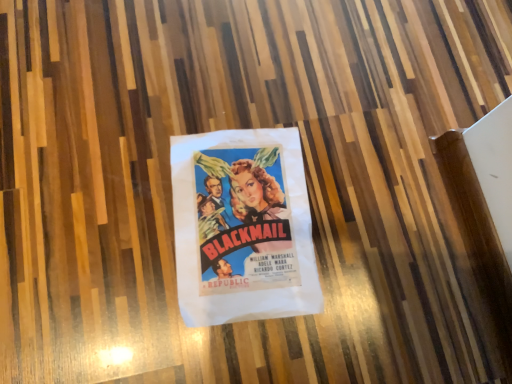
In order to face white paper poster at center, should I rotate leftwards or rightwards?

Rotate left and turn 1.441 degrees.

This screenshot has height=384, width=512. In order to click on white paper poster at center in this screenshot , I will do `click(242, 227)`.

Describe the element at coordinates (242, 227) in the screenshot. This screenshot has width=512, height=384. I see `white paper poster at center` at that location.

What is the approximate height of white paper poster at center?

The height of white paper poster at center is 1.16 inches.

You are a GUI agent. You are given a task and a screenshot of the screen. Output one action in this format:
    pyautogui.click(x=<x>, y=<y>)
    Task: Click on the white paper poster at center
    The image size is (512, 384).
    Given the screenshot: What is the action you would take?
    (242, 227)